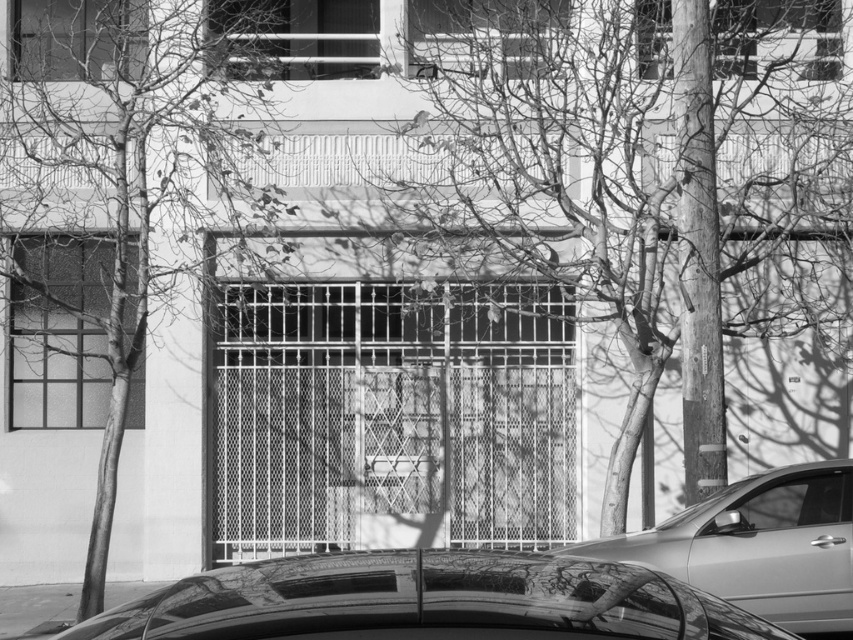
Question: Which point is farther from the camera taking this photo?

Choices:
 (A) (711, 308)
 (B) (811, 518)
 (C) (664, 545)
 (D) (697, 595)

Answer: (A)

Question: Which object is closer to the camera taking this photo?

Choices:
 (A) metallic silver car at lower right
 (B) glossy metallic car at lower center
 (C) bare branches at left

Answer: (B)

Question: Is bare branches at center to the left of glossy metallic car at lower center from the viewer's perspective?

Choices:
 (A) no
 (B) yes

Answer: (A)

Question: Does bare branches at left lie behind metallic silver car at lower right?

Choices:
 (A) no
 (B) yes

Answer: (B)

Question: Does bare branches at left appear on the left side of clear glass window at lower right?

Choices:
 (A) no
 (B) yes

Answer: (B)

Question: Among these objects, which one is farthest from the camera?

Choices:
 (A) bare branches at center
 (B) bare branches at left
 (C) metallic silver car at lower right

Answer: (A)